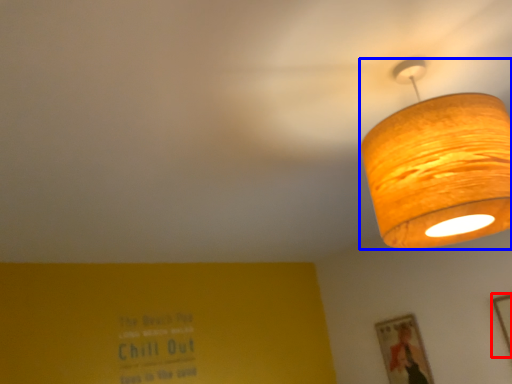
Question: Which of the following is the closest to the observer, picture frame (highlighted by a red box) or lamp (highlighted by a blue box)?

Choices:
 (A) picture frame
 (B) lamp

Answer: (B)